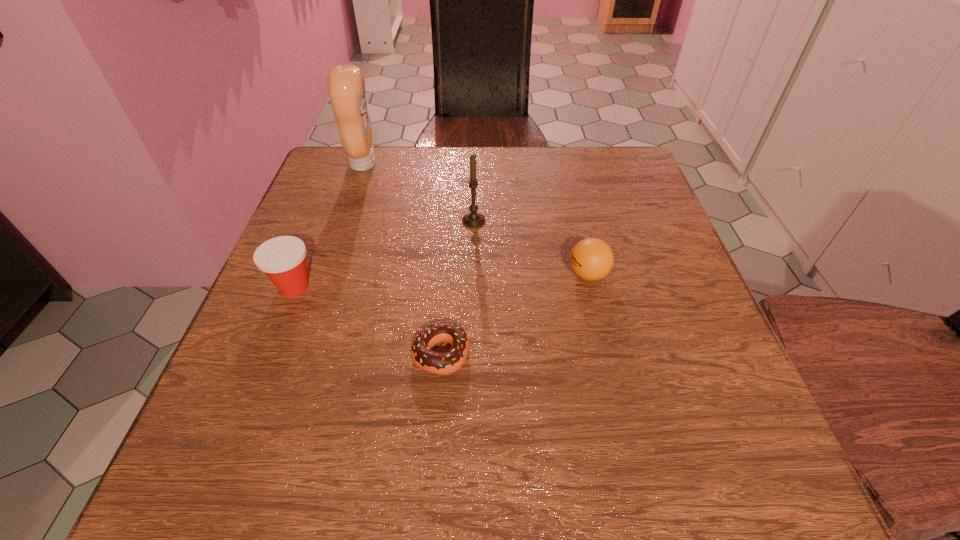
Find the location of a particular element. the tallest object is located at coordinates (346, 85).

This screenshot has width=960, height=540. Identify the location of condiment. (346, 85).

I want to click on the fourth shortest object, so click(473, 220).

Find the location of a particular element. candle is located at coordinates (473, 220).

What are the coordinates of `Dixie cup` in the screenshot? It's located at (282, 259).

Find the location of a particular element. ping-pong ball is located at coordinates (591, 259).

This screenshot has width=960, height=540. I want to click on the nearest object, so click(x=422, y=355).

Find the location of `doughnut`. doughnut is located at coordinates (422, 355).

Where is `free space located 0.320m on the label of the tallest object`? The height and width of the screenshot is (540, 960). free space located 0.320m on the label of the tallest object is located at coordinates (503, 164).

At what (x,y) coordinates should I click in order to perform the action: click on vacant space located 0.340m on the left of the second farthest object. Please return your answer as a coordinate pair (x, y). Image resolution: width=960 pixels, height=540 pixels. Looking at the image, I should click on (307, 221).